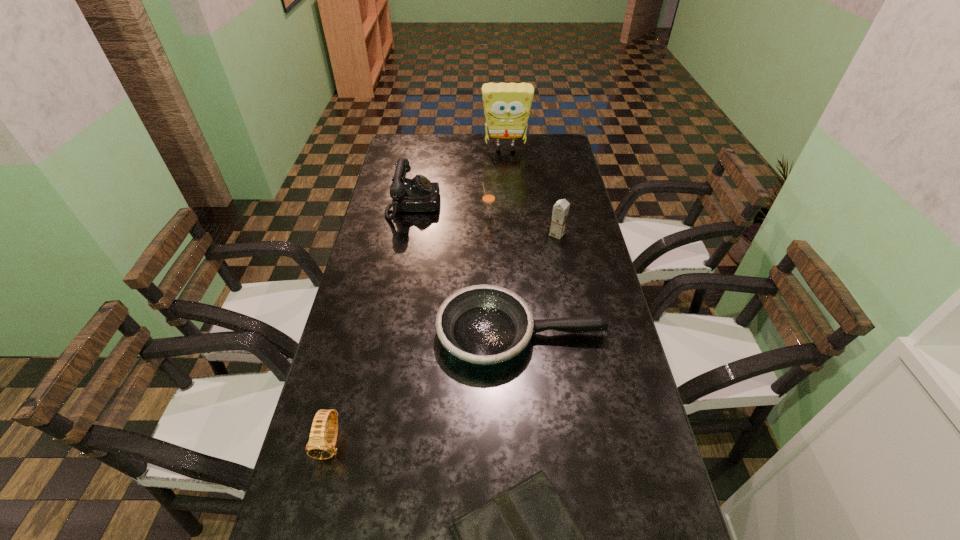
I want to click on the farthest object, so click(x=507, y=106).

You are a GUI agent. You are given a task and a screenshot of the screen. Output one action in this format:
    pyautogui.click(x=<x>, y=<y>)
    Task: Click on the tallest object
    This screenshot has height=540, width=960.
    Given the screenshot: What is the action you would take?
    pyautogui.click(x=507, y=106)

This screenshot has width=960, height=540. I want to click on telephone, so click(418, 194).

Find the location of a particular element. The image size is (960, 540). straw is located at coordinates (488, 197).

I want to click on chocolate milk, so click(560, 211).

Where is `the fifth tallest object`? The image size is (960, 540). the fifth tallest object is located at coordinates 320,448.

Image resolution: width=960 pixels, height=540 pixels. I want to click on the sixth farthest object, so click(x=320, y=448).

Find the location of a particular element. The width and height of the screenshot is (960, 540). the third nearest object is located at coordinates (484, 324).

Where is `free region located on the face of the tallest object`? The image size is (960, 540). free region located on the face of the tallest object is located at coordinates (509, 190).

Where is `free space located 0.250m on the dial of the telephone`? The image size is (960, 540). free space located 0.250m on the dial of the telephone is located at coordinates (506, 205).